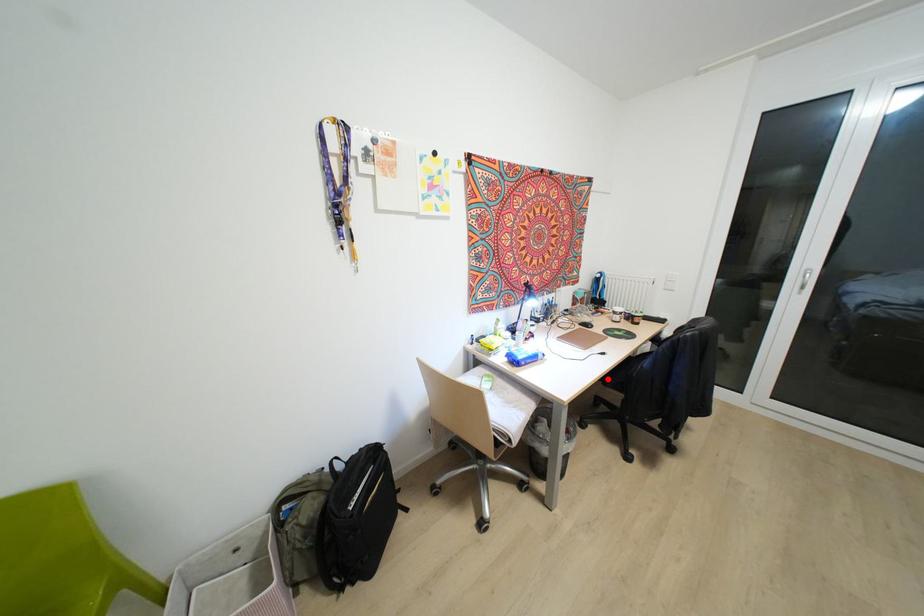
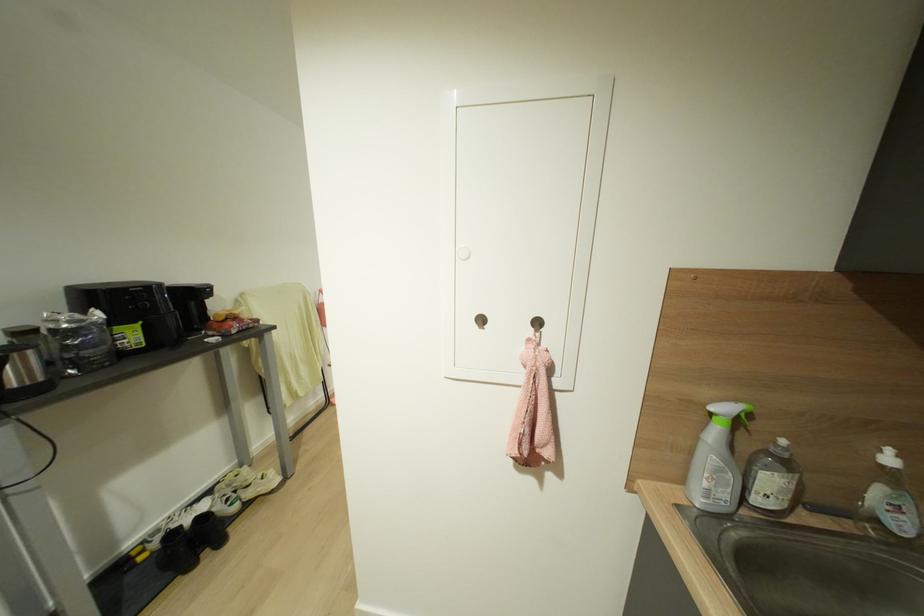
Question: I am providing you with two images of the same scene from different viewpoints. A red point is marked on the first image. Is the red point's position out of view in image 2?

Choices:
 (A) Yes
 (B) No

Answer: (A)